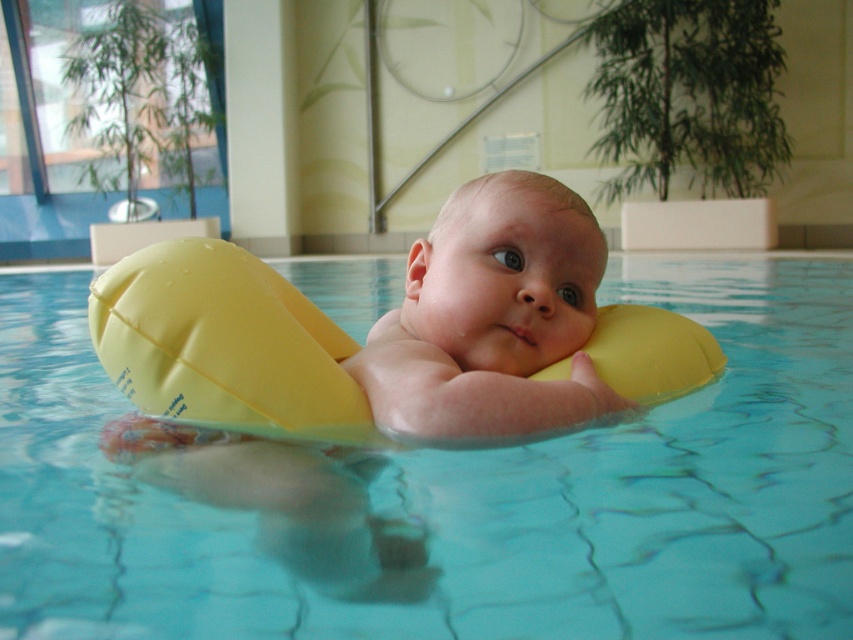
You are a lifeguard at the pool. You notice two flotation devices at the center of the pool. The baby is using one of them. Which one is taller, the transparent yellow float at center or the yellow rubber ring at center?

The transparent yellow float at center is taller than the yellow rubber ring at center.

You are a lifeguard at the pool and need to retrieve both the transparent yellow float at center and the yellow rubber ring at center. If you can only carry one item at a time, which one should you pick up first to minimize the distance walked?

You should pick up the transparent yellow float at center first, then the yellow rubber ring at center since they are 14.11 inches apart, so the total distance walked would be 14.11 inches if you pick them in order.